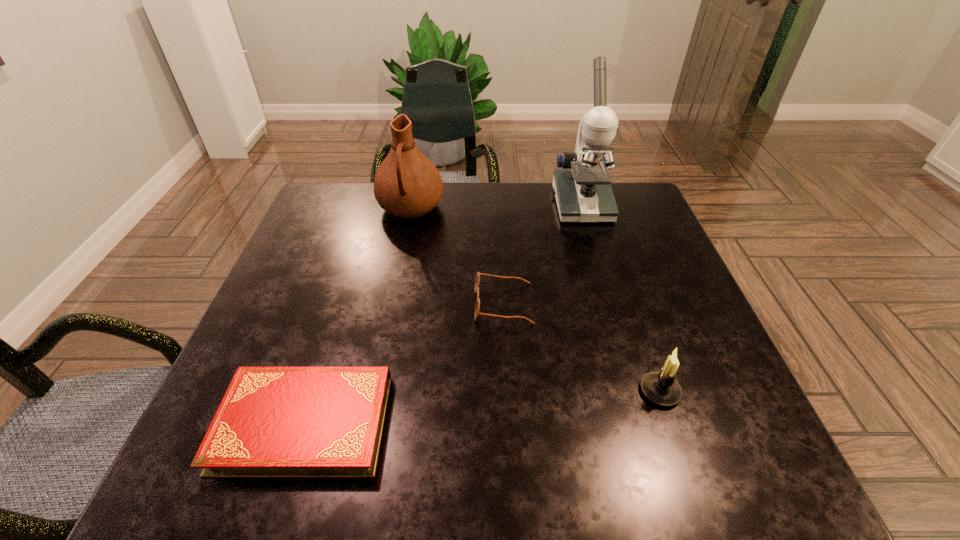
Identify the location of free spot that satisfies the following two spatial constraints: 1. on the side of the third tallest object with the handle; 2. on the left side of the fourth shortest object. (373, 391).

Locate an element on the screen. The width and height of the screenshot is (960, 540). vacant space that satisfies the following two spatial constraints: 1. on the front-facing side of the spectacles; 2. on the right side of the candle holder is located at coordinates (508, 391).